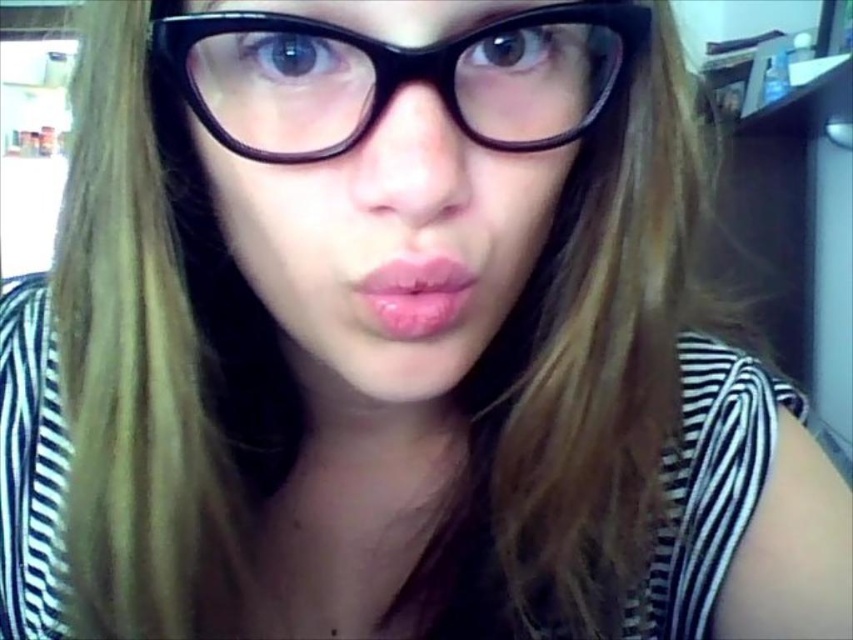
Question: Which object is farther from the camera taking this photo?

Choices:
 (A) black plastic glasses at center
 (B) pink glossy lips at center
 (C) black matte glasses at center

Answer: (B)

Question: Observing the image, what is the correct spatial positioning of black matte glasses at center in reference to black plastic glasses at center?

Choices:
 (A) below
 (B) above

Answer: (A)

Question: Which object is the closest to the pink glossy lips at center?

Choices:
 (A) black matte glasses at center
 (B) black plastic glasses at center

Answer: (A)

Question: Can you confirm if black plastic glasses at center is smaller than pink glossy lips at center?

Choices:
 (A) yes
 (B) no

Answer: (B)

Question: Is black matte glasses at center wider than black plastic glasses at center?

Choices:
 (A) yes
 (B) no

Answer: (B)

Question: Which of the following is the closest to the observer?

Choices:
 (A) pink glossy lips at center
 (B) black matte glasses at center

Answer: (B)